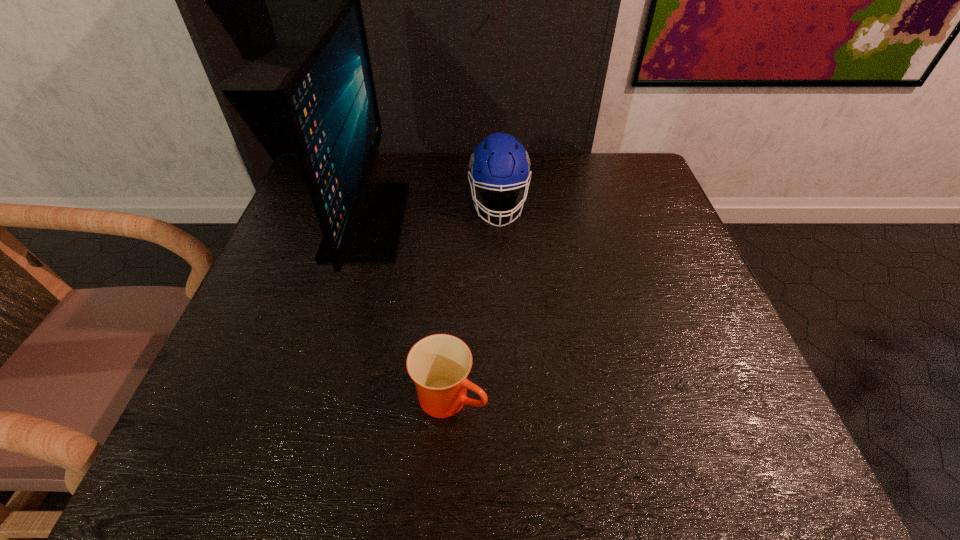
Identify the location of free area in between the leftmost object and the cup. coord(409,309).

Locate an element on the screen. The image size is (960, 540). free spot between the cup and the monitor is located at coordinates (409, 309).

I want to click on vacant area between the football helmet and the nearest object, so click(474, 301).

Image resolution: width=960 pixels, height=540 pixels. Find the location of `free space between the football helmet and the nearest object`. free space between the football helmet and the nearest object is located at coordinates (474, 301).

Locate an element on the screen. The width and height of the screenshot is (960, 540). unoccupied position between the tallest object and the football helmet is located at coordinates (433, 213).

Identify the location of vacant region between the shortest object and the leftmost object. (409, 309).

Where is `free space between the football helmet and the tallest object`? free space between the football helmet and the tallest object is located at coordinates (433, 213).

Locate an element on the screen. This screenshot has width=960, height=540. free space between the football helmet and the cup is located at coordinates (474, 301).

Where is `free point between the football helmet and the monitor`? This screenshot has height=540, width=960. free point between the football helmet and the monitor is located at coordinates (433, 213).

Find the location of `the second closest object to the monitor`. the second closest object to the monitor is located at coordinates (439, 364).